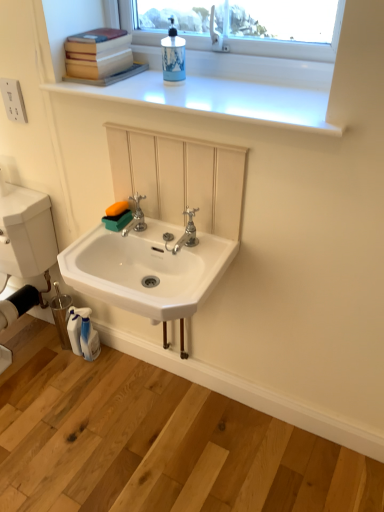
Locate an element on the screen. Image resolution: width=384 pixels, height=512 pixels. unoccupied space behind polished chrome faucet at center, positioned as the 1th tap in right-to-left order is located at coordinates (169, 232).